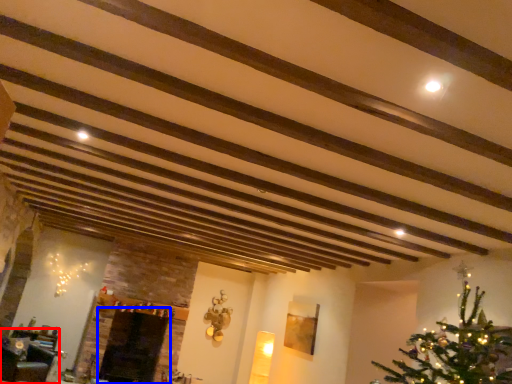
Question: Which of the following is the farthest to the observer, furniture (highlighted by a red box) or fireplace (highlighted by a blue box)?

Choices:
 (A) furniture
 (B) fireplace

Answer: (B)